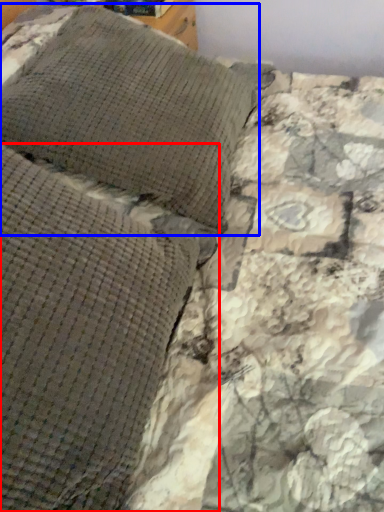
Question: Which object is closer to the camera taking this photo, pillow (highlighted by a red box) or pillow (highlighted by a blue box)?

Choices:
 (A) pillow
 (B) pillow

Answer: (A)